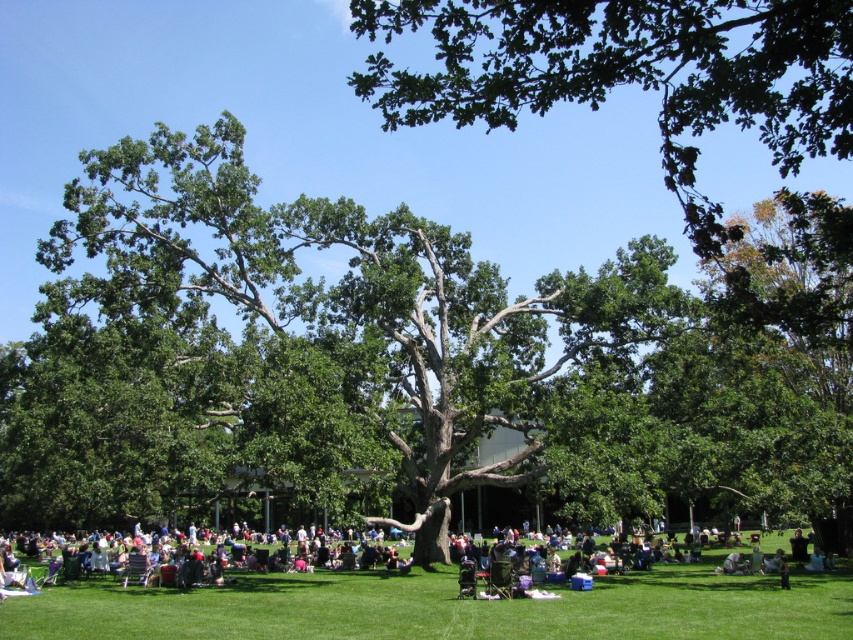
Does point (715, 216) come farther from viewer compared to point (786, 595)?

That is True.

Who is taller, green leafy tree at upper center or dark green fabric chair at lower center?

green leafy tree at upper center

At what (x,y) coordinates should I click in order to perform the action: click on green leafy tree at upper center. Please return your answer as a coordinate pair (x, y). The image size is (853, 640). Looking at the image, I should click on (630, 72).

Locate an element on the screen. The width and height of the screenshot is (853, 640). green leafy tree at center is located at coordinates (401, 358).

How much distance is there between green leafy tree at center and dark green fabric chair at lower center?

The distance of green leafy tree at center from dark green fabric chair at lower center is 13.34 meters.

Is point (422, 330) positioned after point (383, 577)?

Yes.

This screenshot has height=640, width=853. Find the location of `green leafy tree at center`. green leafy tree at center is located at coordinates (401, 358).

What do you see at coordinates (401, 358) in the screenshot?
I see `green leafy tree at center` at bounding box center [401, 358].

Measure the distance between point (260,372) and camera.

The distance of point (260,372) from camera is 51.01 meters.

Locate an element on the screen. The width and height of the screenshot is (853, 640). green leafy tree at center is located at coordinates (401, 358).